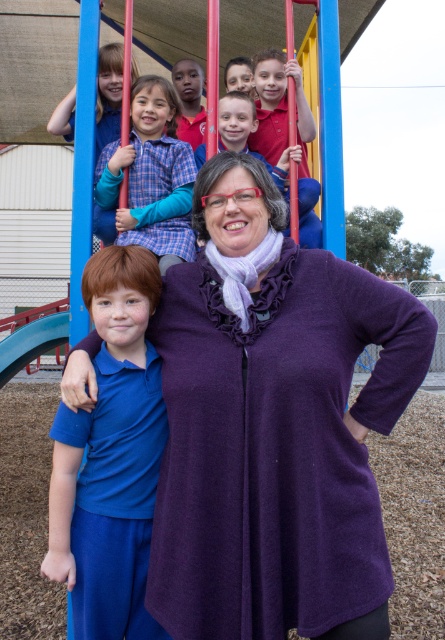
Does purple fleece sweater at center appear on the right side of matte blue shirt at center?

Correct, you'll find purple fleece sweater at center to the right of matte blue shirt at center.

Can you confirm if purple fleece sweater at center is wider than matte blue shirt at center?

Yes, purple fleece sweater at center is wider than matte blue shirt at center.

Who is more distant from viewer, (83, 404) or (195, 72)?

Positioned behind is point (195, 72).

Locate an element on the screen. Image resolution: width=445 pixels, height=640 pixels. purple fleece sweater at center is located at coordinates (274, 426).

Is purple fleece sweater at center shorter than plaid shirt at upper center?

In fact, purple fleece sweater at center may be taller than plaid shirt at upper center.

Is purple fleece sweater at center bigger than plaid shirt at upper center?

Yes, purple fleece sweater at center is bigger than plaid shirt at upper center.

Is point (344, 358) positioned in front of point (129, 152)?

Yes, point (344, 358) is closer to viewer.

At what (x,y) coordinates should I click in order to perform the action: click on purple fleece sweater at center. Please return your answer as a coordinate pair (x, y). The height and width of the screenshot is (640, 445). Looking at the image, I should click on (274, 426).

Is blue fabric shirt at center shorter than matte red shirt at upper center?

Incorrect, blue fabric shirt at center's height does not fall short of matte red shirt at upper center's.

Is point (93, 420) positioned in front of point (238, 136)?

Yes, point (93, 420) is in front of point (238, 136).

You are a GUI agent. You are given a task and a screenshot of the screen. Output one action in this format:
    pyautogui.click(x=<x>, y=<y>)
    Task: Click on the blue fabric shirt at center
    This screenshot has height=640, width=445.
    Given the screenshot: What is the action you would take?
    pyautogui.click(x=110, y=456)